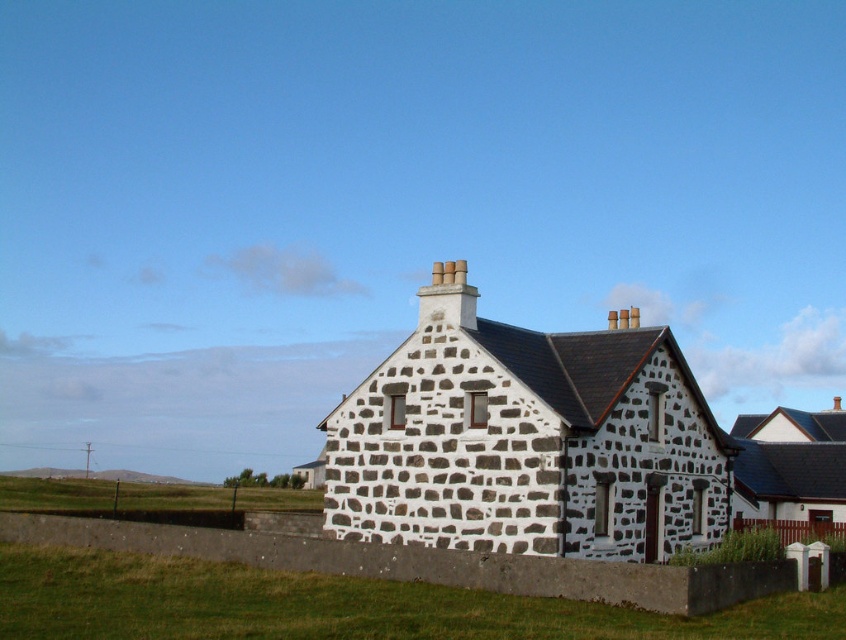
Can you confirm if stone/brick cottage at center is shorter than green grass at lower center?

No.

Does point (398, 422) lie behind point (789, 628)?

Yes.

Where is `stone/brick cottage at center`? The image size is (846, 640). stone/brick cottage at center is located at coordinates (526, 440).

Find the location of a particular element. This screenshot has width=846, height=640. stone/brick cottage at center is located at coordinates [526, 440].

Who is lower down, green grass at lower center or white stone cottage at right?

Positioned lower is white stone cottage at right.

How much distance is there between green grass at lower center and white stone cottage at right?

green grass at lower center and white stone cottage at right are 38.39 meters apart from each other.

The width and height of the screenshot is (846, 640). In order to click on green grass at lower center in this screenshot , I will do `click(338, 605)`.

Find the location of a particular element. This screenshot has height=640, width=846. green grass at lower center is located at coordinates (338, 605).

Does stone/brick cottage at center have a lesser width compared to white stone cottage at right?

Correct, stone/brick cottage at center's width is less than white stone cottage at right's.

Is stone/brick cottage at center wider than white stone cottage at right?

Incorrect, stone/brick cottage at center's width does not surpass white stone cottage at right's.

Is point (645, 456) closer to camera compared to point (764, 524)?

Yes.

Locate an element on the screen. This screenshot has width=846, height=640. stone/brick cottage at center is located at coordinates (526, 440).